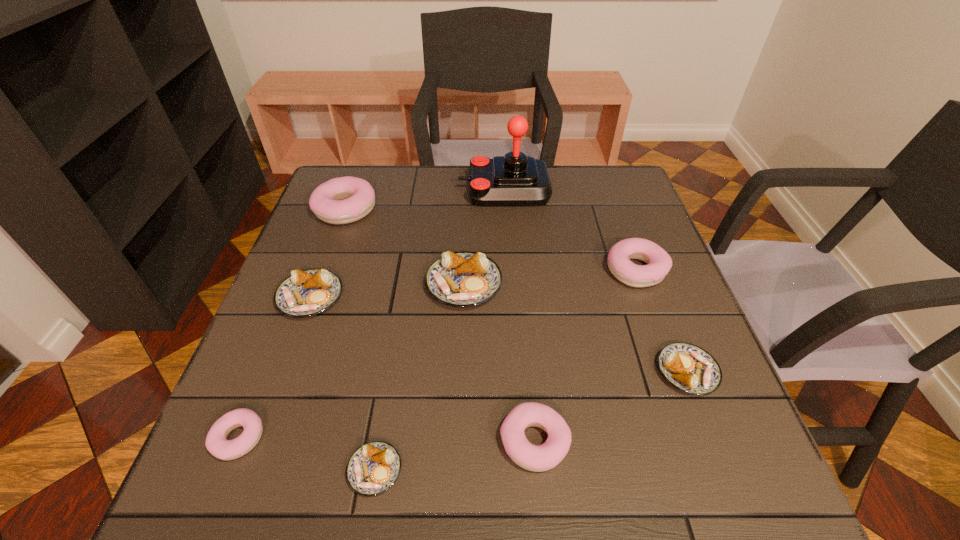
Where is `free point between the joystick and the farthest pastry`? Image resolution: width=960 pixels, height=540 pixels. free point between the joystick and the farthest pastry is located at coordinates (425, 200).

Find the location of `free space between the third pink pastry from left to right and the fourth pastry from left to right`. free space between the third pink pastry from left to right and the fourth pastry from left to right is located at coordinates (455, 456).

The height and width of the screenshot is (540, 960). What are the coordinates of `free space that is in between the farthest pink pastry and the tallest object` in the screenshot? It's located at (425, 200).

Where is `object that is the fourth nearest to the second smallest pink pastry`? object that is the fourth nearest to the second smallest pink pastry is located at coordinates (659, 263).

I want to click on the closest object to the smallest pink pastry, so click(x=373, y=468).

Find the location of `pastry object that ranks as the sixth closest to the smallest pink pastry`. pastry object that ranks as the sixth closest to the smallest pink pastry is located at coordinates (687, 367).

Select which pastry is the fourth closest to the second biggest pink pastry. Please provide its 2D coordinates. Your answer should be formatted as a tuple, i.e. [(x, y)], where the tuple contains the x and y coordinates of a point satisfying the conditions above.

[(373, 468)]

Locate an element on the screen. pink pastry that is the third closest to the biggest brown pastry is located at coordinates click(x=659, y=263).

Identify which pink pastry is located as the nearest to the farthest pink pastry. Please provide its 2D coordinates. Your answer should be formatted as a tuple, i.e. [(x, y)], where the tuple contains the x and y coordinates of a point satisfying the conditions above.

[(216, 443)]

I want to click on brown pastry identified as the third closest to the third nearest pink pastry, so click(x=373, y=468).